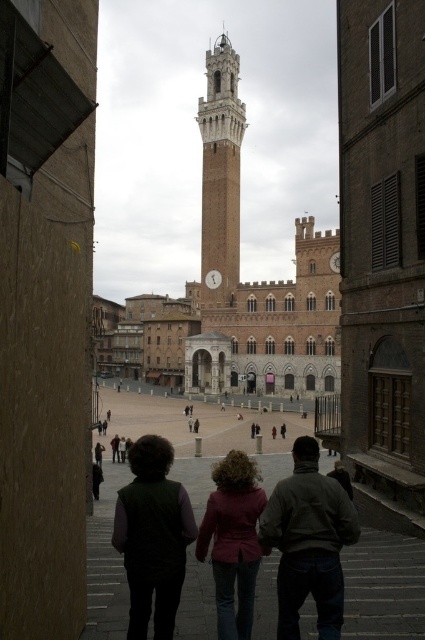
You are standing on the stone staircase in Piazza del Campo, looking towards the Torre del Mangia. You notice two people wearing dark gray sweater at center and maroon fabric coat at center. Which person is positioned to the right of the other?

The dark gray sweater at center is to the right of the maroon fabric coat at center.